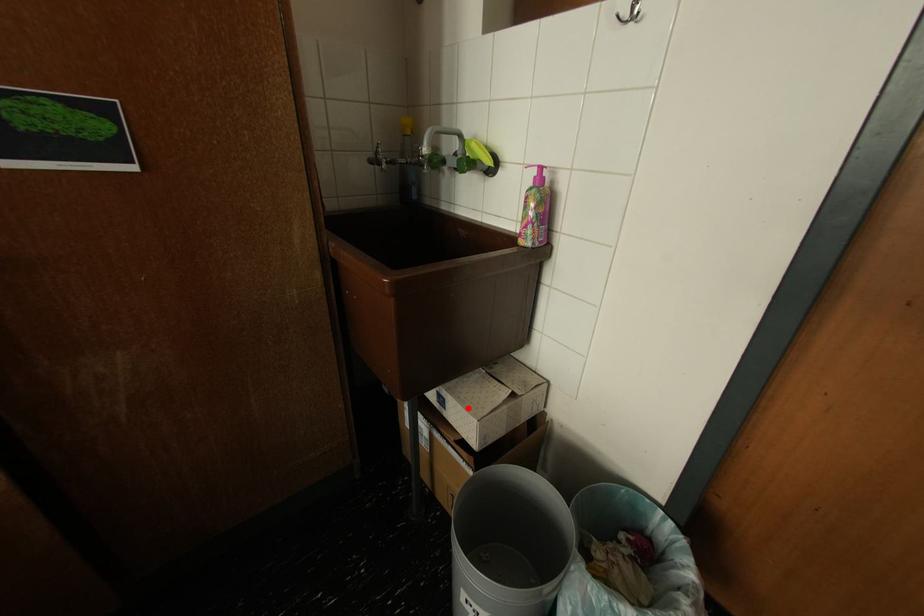
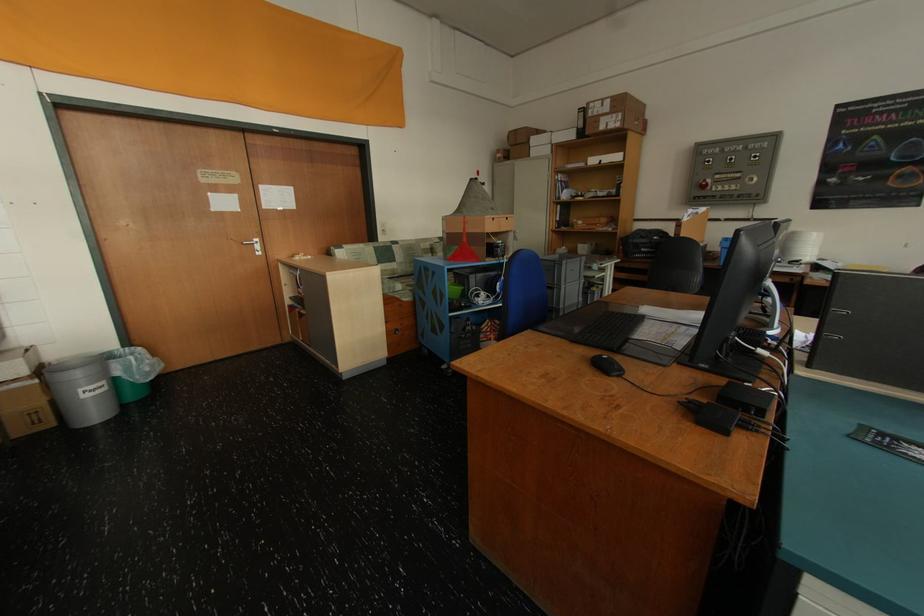
Question: I am providing you with two images of the same scene from different viewpoints. In image1, a red point is highlighted. Considering the same 3D point in image2, which of the following is correct?

Choices:
 (A) It is closer
 (B) It is farther

Answer: (B)